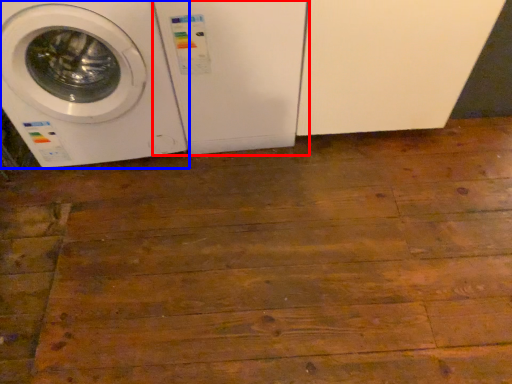
Question: Which of the following is the farthest to the observer, washing machine (highlighted by a red box) or washing machine (highlighted by a blue box)?

Choices:
 (A) washing machine
 (B) washing machine

Answer: (A)